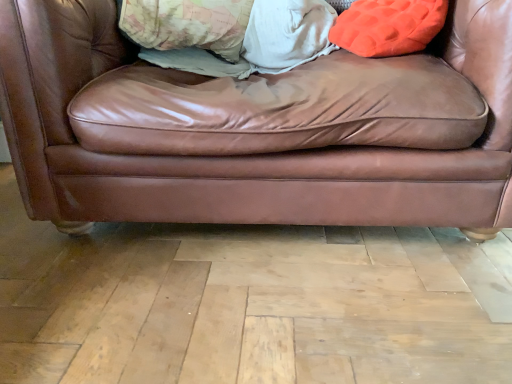
Question: Is patterned fabric pillow at upper center thinner than orange fuzzy pillow at upper right?

Choices:
 (A) no
 (B) yes

Answer: (A)

Question: Is patterned fabric pillow at upper center positioned before orange fuzzy pillow at upper right?

Choices:
 (A) yes
 (B) no

Answer: (B)

Question: From the image's perspective, is patterned fabric pillow at upper center located above orange fuzzy pillow at upper right?

Choices:
 (A) yes
 (B) no

Answer: (A)

Question: Is patterned fabric pillow at upper center positioned far away from orange fuzzy pillow at upper right?

Choices:
 (A) no
 (B) yes

Answer: (A)

Question: Is patterned fabric pillow at upper center not within orange fuzzy pillow at upper right?

Choices:
 (A) no
 (B) yes

Answer: (B)

Question: Does patterned fabric pillow at upper center appear on the right side of orange fuzzy pillow at upper right?

Choices:
 (A) no
 (B) yes

Answer: (A)

Question: Can you confirm if brown leather couch at center is shorter than orange fuzzy pillow at upper right?

Choices:
 (A) no
 (B) yes

Answer: (A)

Question: Is the depth of brown leather couch at center less than that of orange fuzzy pillow at upper right?

Choices:
 (A) yes
 (B) no

Answer: (A)

Question: From a real-world perspective, is brown leather couch at center on orange fuzzy pillow at upper right?

Choices:
 (A) no
 (B) yes

Answer: (A)

Question: Can you confirm if brown leather couch at center is bigger than orange fuzzy pillow at upper right?

Choices:
 (A) no
 (B) yes

Answer: (B)

Question: Is brown leather couch at center facing away from orange fuzzy pillow at upper right?

Choices:
 (A) yes
 (B) no

Answer: (B)

Question: Are brown leather couch at center and orange fuzzy pillow at upper right located far from each other?

Choices:
 (A) yes
 (B) no

Answer: (B)

Question: Considering the relative positions of orange fuzzy pillow at upper right and patterned fabric pillow at upper center in the image provided, is orange fuzzy pillow at upper right to the left of patterned fabric pillow at upper center from the viewer's perspective?

Choices:
 (A) no
 (B) yes

Answer: (A)